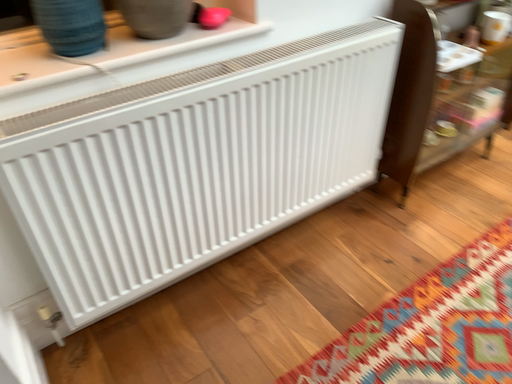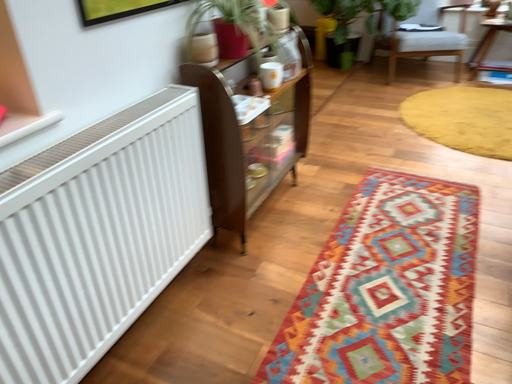
Question: How did the camera likely rotate when shooting the video?

Choices:
 (A) rotated upward
 (B) rotated downward

Answer: (A)